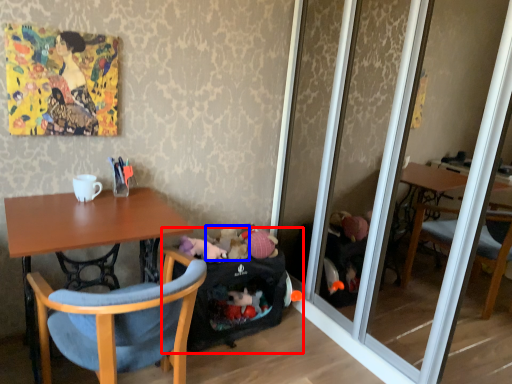
Question: Among these objects, which one is farthest to the camera, baby carriage (highlighted by a red box) or toy (highlighted by a blue box)?

Choices:
 (A) baby carriage
 (B) toy

Answer: (B)